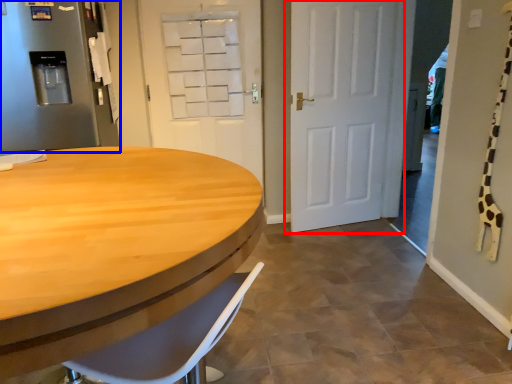
Question: Which point is closer to the camera, door (highlighted by a red box) or refrigerator (highlighted by a blue box)?

Choices:
 (A) door
 (B) refrigerator

Answer: (B)